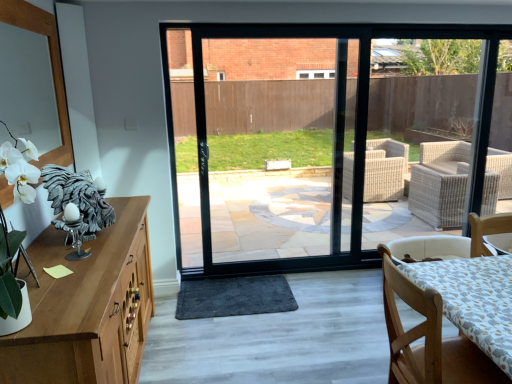
Question: Does wooden chair at lower right come behind dark gray plush mat at center?

Choices:
 (A) yes
 (B) no

Answer: (B)

Question: Is wooden chair at lower right oriented away from dark gray plush mat at center?

Choices:
 (A) no
 (B) yes

Answer: (A)

Question: Is wooden chair at lower right in front of dark gray plush mat at center?

Choices:
 (A) no
 (B) yes

Answer: (B)

Question: Is wooden chair at lower right bigger than dark gray plush mat at center?

Choices:
 (A) no
 (B) yes

Answer: (B)

Question: Is wooden chair at lower right surrounding dark gray plush mat at center?

Choices:
 (A) no
 (B) yes

Answer: (A)

Question: Considering the relative positions of wooden chair at lower right and dark gray plush mat at center in the image provided, is wooden chair at lower right to the right of dark gray plush mat at center from the viewer's perspective?

Choices:
 (A) no
 (B) yes

Answer: (B)

Question: Considering the relative sizes of dark gray plush mat at center and wooden chair at lower right in the image provided, is dark gray plush mat at center smaller than wooden chair at lower right?

Choices:
 (A) no
 (B) yes

Answer: (B)

Question: Is dark gray plush mat at center shorter than wooden chair at lower right?

Choices:
 (A) yes
 (B) no

Answer: (A)

Question: Considering the relative sizes of dark gray plush mat at center and wooden chair at lower right in the image provided, is dark gray plush mat at center wider than wooden chair at lower right?

Choices:
 (A) no
 (B) yes

Answer: (B)

Question: Is dark gray plush mat at center facing towards wooden chair at lower right?

Choices:
 (A) yes
 (B) no

Answer: (B)

Question: From the image's perspective, does dark gray plush mat at center appear higher than wooden chair at lower right?

Choices:
 (A) yes
 (B) no

Answer: (B)

Question: Is dark gray plush mat at center positioned with its back to wooden chair at lower right?

Choices:
 (A) yes
 (B) no

Answer: (B)

Question: In terms of height, does dark gray plush mat at center look taller or shorter compared to wooden chair at lower right?

Choices:
 (A) tall
 (B) short

Answer: (B)